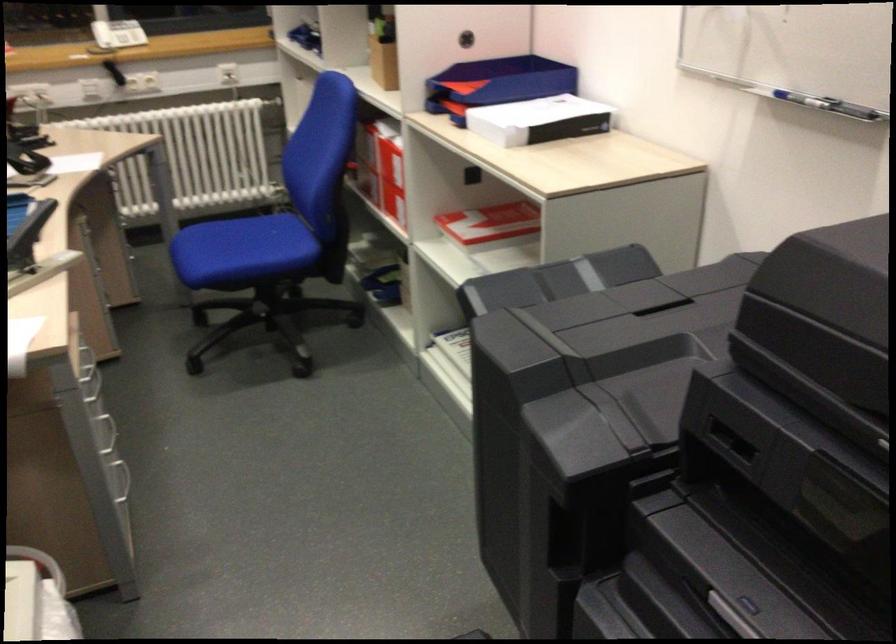
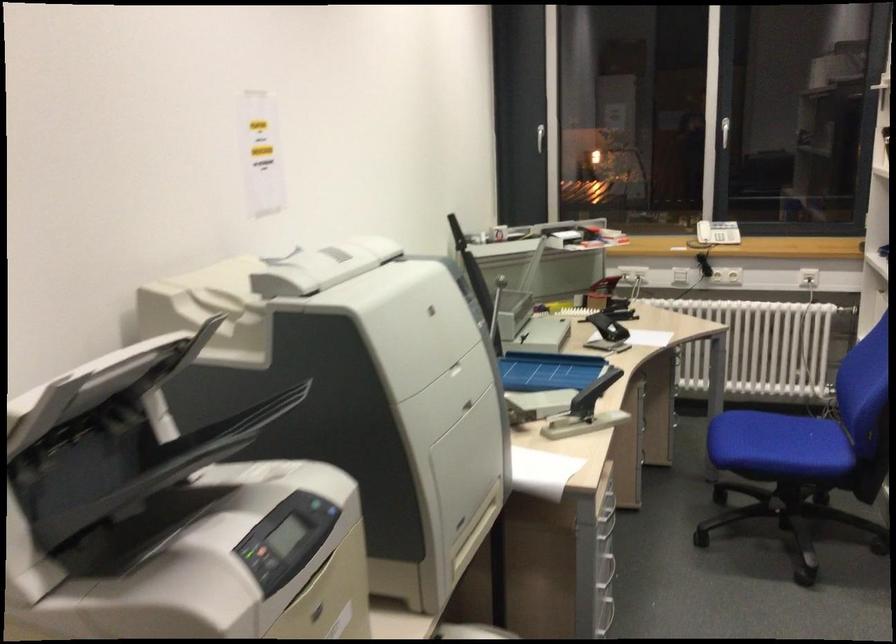
Question: Based on the continuous images, in which direction is the camera rotating? Reply with the corresponding letter.

Choices:
 (A) Left
 (B) Right
 (C) Up
 (D) Down

Answer: (A)